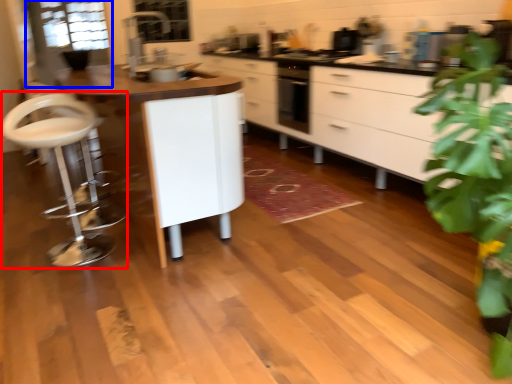
Question: Which point is closer to the camera, swivel chair (highlighted by a red box) or glass door (highlighted by a blue box)?

Choices:
 (A) swivel chair
 (B) glass door

Answer: (A)